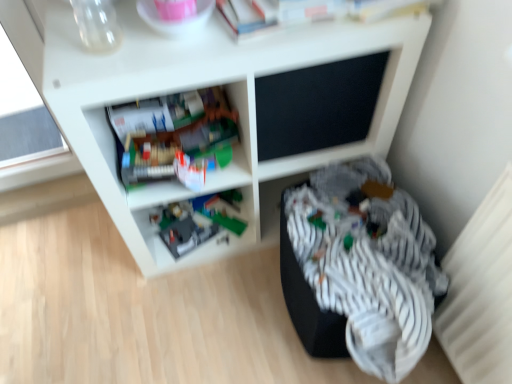
Where is `vacant region to the left of striped fabric at lower right`? This screenshot has width=512, height=384. vacant region to the left of striped fabric at lower right is located at coordinates (232, 314).